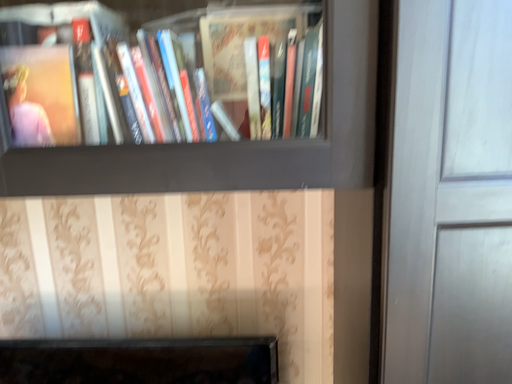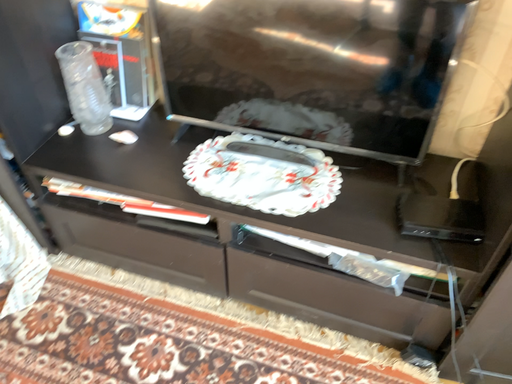
Question: How did the camera likely rotate when shooting the video?

Choices:
 (A) rotated left
 (B) rotated right

Answer: (A)